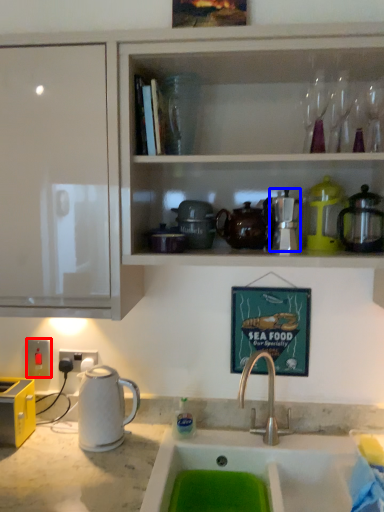
Question: Which point is closer to the camera, electric outlet (highlighted by a red box) or appliance (highlighted by a blue box)?

Choices:
 (A) electric outlet
 (B) appliance

Answer: (B)